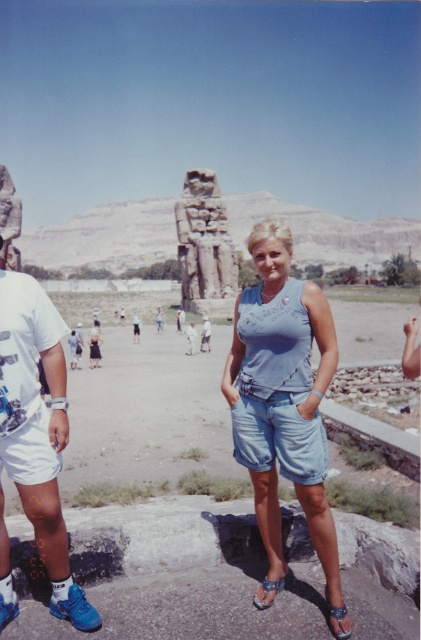
Question: Is blue synthetic sneakers at lower left above denim textured sandal at lower center?

Choices:
 (A) yes
 (B) no

Answer: (A)

Question: In this image, where is light blue denim shorts at center located relative to carved stone statue at center?

Choices:
 (A) above
 (B) below

Answer: (B)

Question: Among these points, which one is nearest to the camera?

Choices:
 (A) (40, 312)
 (B) (258, 605)

Answer: (B)

Question: Which object appears closest to the camera in this image?

Choices:
 (A) carved stone statue at center
 (B) leather sandal at lower right
 (C) blue synthetic sneakers at lower left
 (D) denim textured sandal at lower center

Answer: (B)

Question: Does carved stone statue at center appear under denim textured sandal at lower center?

Choices:
 (A) no
 (B) yes

Answer: (A)

Question: Which object is the closest to the denim textured sandal at lower center?

Choices:
 (A) carved stone statue at center
 (B) blue synthetic sneakers at lower left
 (C) light blue denim shorts at center

Answer: (C)